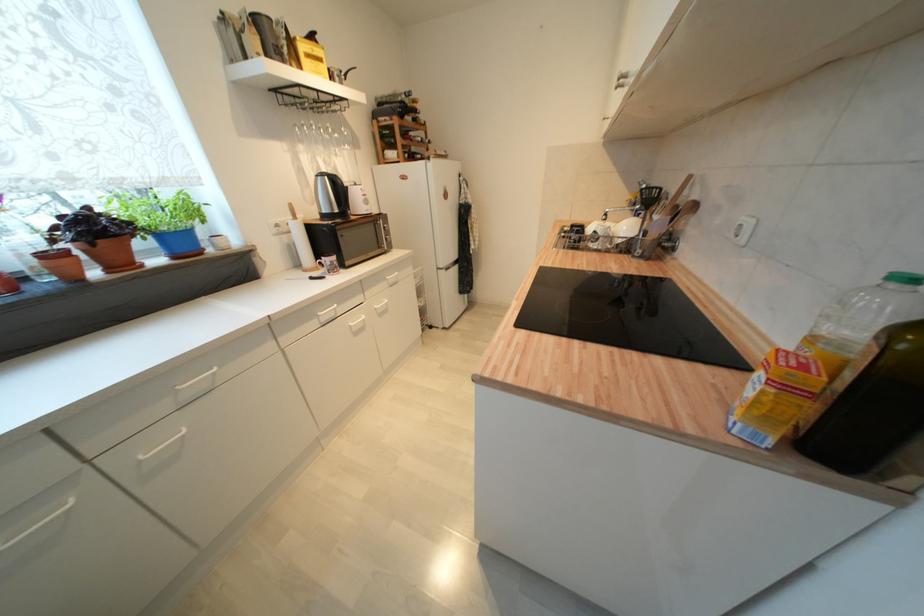
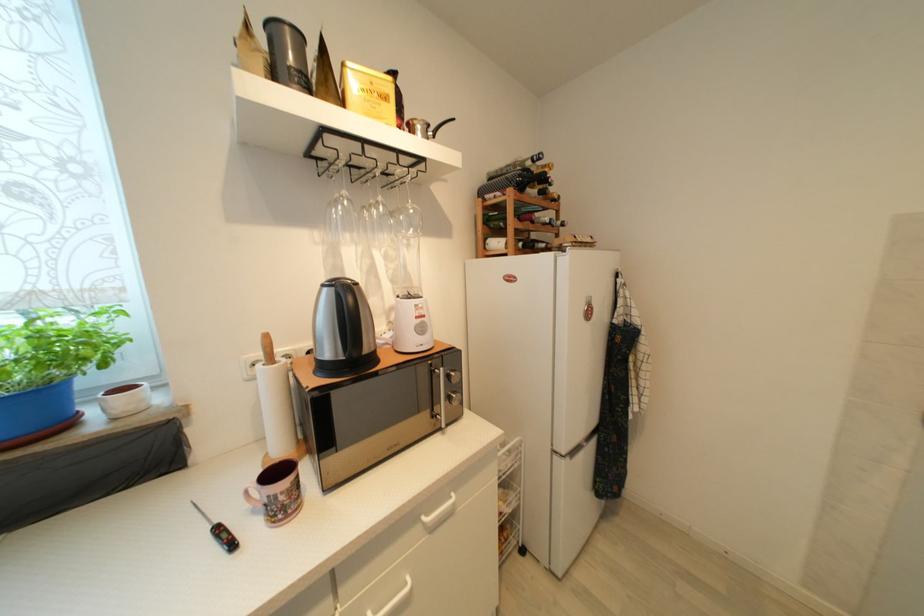
Where in the second image is the point corresponding to (x=414, y=121) from the first image?

(538, 193)